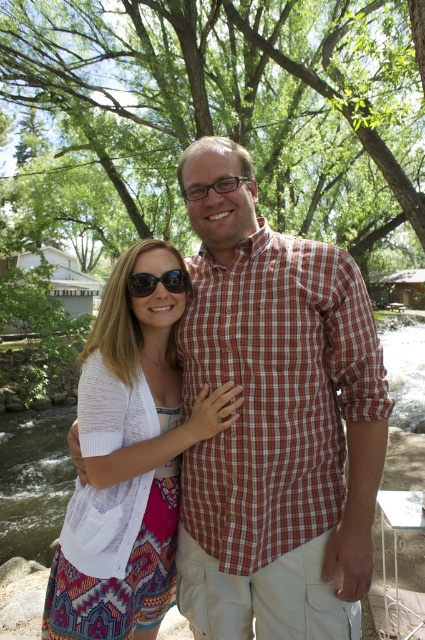
The width and height of the screenshot is (425, 640). What are the coordinates of `green leafy tree at upper center` in the screenshot? It's located at (224, 112).

Who is shorter, white textured cardigan at center or black reflective sunglasses at center?

black reflective sunglasses at center

Does white textured cardigan at center appear under black reflective sunglasses at center?

Yes, white textured cardigan at center is below black reflective sunglasses at center.

The height and width of the screenshot is (640, 425). Find the location of `white textured cardigan at center`. white textured cardigan at center is located at coordinates (129, 461).

Between green water at creek center and black reflective sunglasses at center, which one is positioned lower?

green water at creek center is lower down.

Is green water at creek center positioned before black reflective sunglasses at center?

No.

Which is behind, point (25, 420) or point (189, 285)?

The point (25, 420) is more distant.

You are a GUI agent. You are given a task and a screenshot of the screen. Output one action in this format:
    pyautogui.click(x=<x>, y=<y>)
    Task: Click on the green water at creek center
    The height and width of the screenshot is (640, 425).
    Given the screenshot: What is the action you would take?
    pyautogui.click(x=34, y=481)